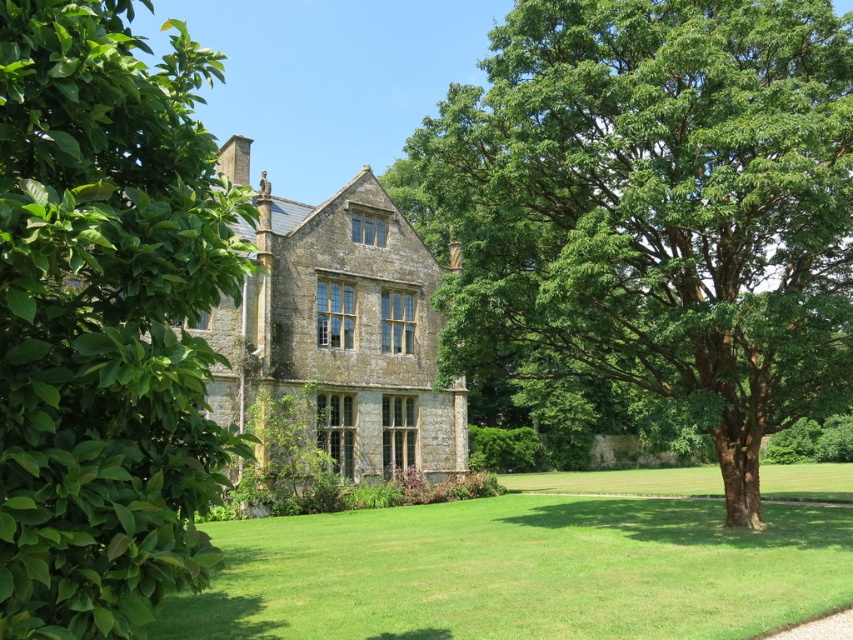
Question: Based on their relative distances, which object is nearer to the green leafy tree at right?

Choices:
 (A) green leafy bush at left
 (B) green grass lawn at center

Answer: (B)

Question: Which object is closer to the camera taking this photo?

Choices:
 (A) green leafy tree at right
 (B) green grass lawn at center

Answer: (B)

Question: Does green leafy tree at right appear on the left side of green leafy bush at left?

Choices:
 (A) yes
 (B) no

Answer: (B)

Question: Is green leafy bush at left to the right of green grass lawn at center from the viewer's perspective?

Choices:
 (A) no
 (B) yes

Answer: (A)

Question: Can you confirm if green leafy tree at right is positioned below green leafy bush at left?

Choices:
 (A) no
 (B) yes

Answer: (A)

Question: Which point is closer to the camera?

Choices:
 (A) (57, 61)
 (B) (802, 262)

Answer: (A)